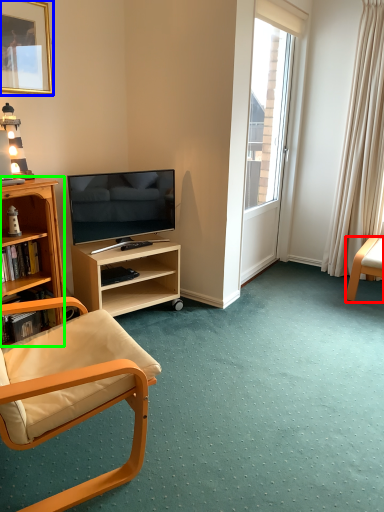
Question: Considering the real-world distances, which object is farthest from chair (highlighted by a red box)? picture frame (highlighted by a blue box) or desk (highlighted by a green box)?

Choices:
 (A) picture frame
 (B) desk

Answer: (A)